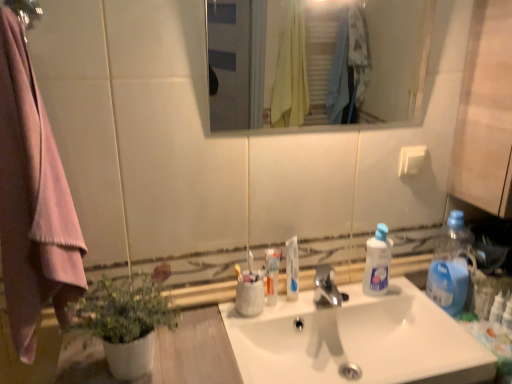
This screenshot has height=384, width=512. I want to click on vacant point to the right of transparent plastic bottle at sink, which is the second bottle in right-to-left order, so click(414, 299).